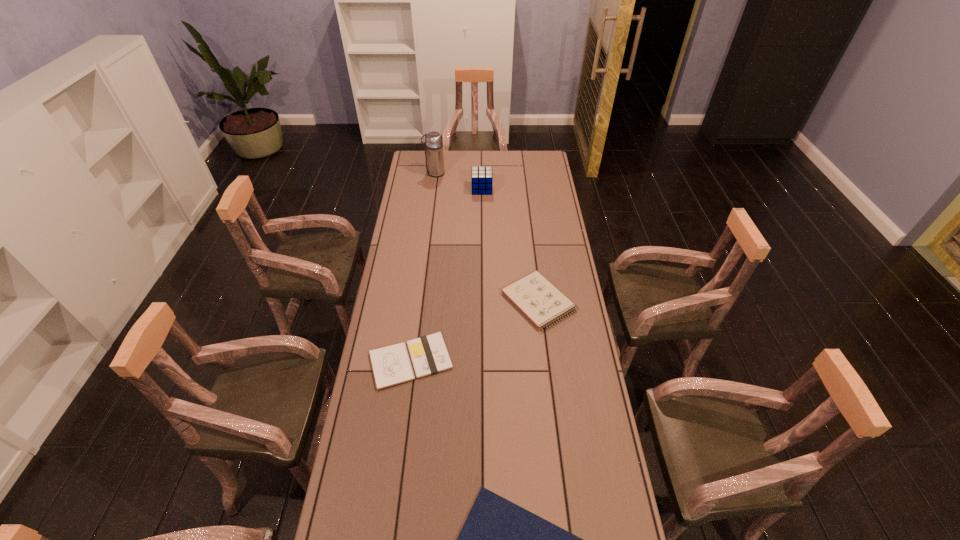
Locate an element on the screen. The image size is (960, 540). notepad that is at the left edge is located at coordinates (391, 365).

Identify the location of object located at the right edge. (539, 300).

Identify the location of object present at the far left corner. [x=433, y=143].

Find the location of a particular element. vacant space at the left edge is located at coordinates (398, 254).

You are a GUI agent. You are given a task and a screenshot of the screen. Output one action in this format:
    pyautogui.click(x=<x>, y=<y>)
    Task: Click on the free space at the right edge
    The image size is (960, 540).
    Given the screenshot: What is the action you would take?
    pyautogui.click(x=583, y=500)

You are a GUI agent. You are given a task and a screenshot of the screen. Output one action in this format:
    pyautogui.click(x=<x>, y=<y>)
    Task: Click on the vacant region at the far right corner of the desktop
    This screenshot has width=960, height=540.
    Given the screenshot: What is the action you would take?
    pyautogui.click(x=548, y=164)

I want to click on free area in between the fourth shortest object and the tallest object, so click(x=458, y=181).

Locate an element on the screen. This screenshot has width=960, height=540. vacant point located between the farthest object and the cube is located at coordinates (458, 181).

Locate an element on the screen. The width and height of the screenshot is (960, 540). free space between the farthest object and the second farthest object is located at coordinates (458, 181).

Locate an element on the screen. Image resolution: width=960 pixels, height=540 pixels. object that stands as the fourth closest to the thermos bottle is located at coordinates (499, 539).